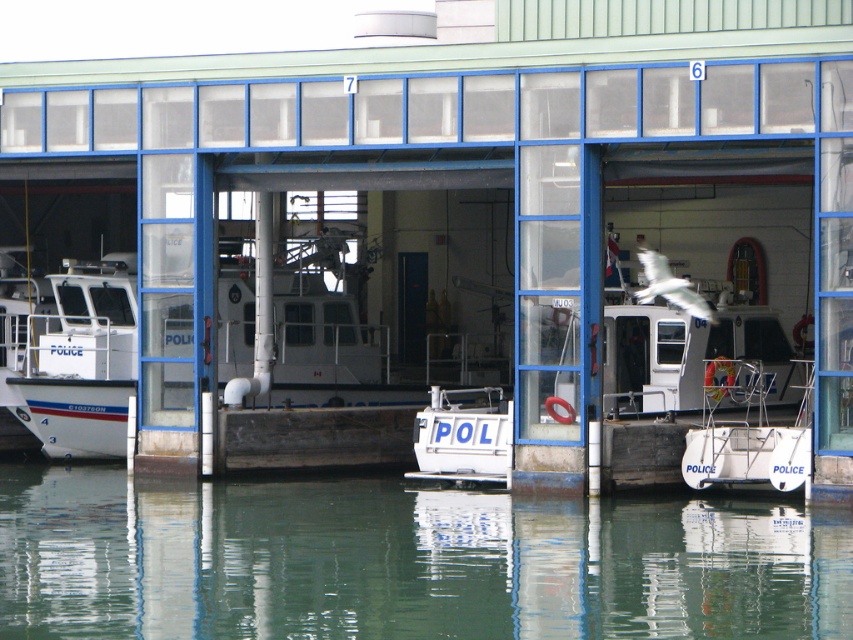
Question: Which object is closer to the camera taking this photo?

Choices:
 (A) white plastic boat at lower right
 (B) white matte police boat at left
 (C) white matte/polished boat at center

Answer: (C)

Question: Which point is farther from the camera taking this photo?

Choices:
 (A) coord(12,337)
 (B) coord(793,536)
 (C) coord(462,456)

Answer: (A)

Question: Does white matte police boat at left appear on the right side of white plastic boat at lower right?

Choices:
 (A) no
 (B) yes

Answer: (A)

Question: Is white plastic boat at lower right thinner than white matte/polished boat at center?

Choices:
 (A) no
 (B) yes

Answer: (B)

Question: Which of the following is the closest to the observer?

Choices:
 (A) white matte/polished boat at center
 (B) green reflective water at lower center
 (C) white matte police boat at left

Answer: (B)

Question: Is green reflective water at lower center closer to camera compared to white plastic boat at lower right?

Choices:
 (A) no
 (B) yes

Answer: (B)